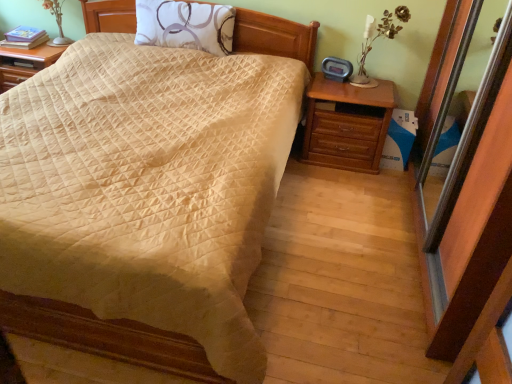
What do you see at coordinates (57, 22) in the screenshot?
I see `matte silver table lamp at upper left, which appears as the first table lamp when viewed from the left` at bounding box center [57, 22].

Where is `beige quilted bed at center`? The height and width of the screenshot is (384, 512). beige quilted bed at center is located at coordinates (105, 337).

Where is `white fabric pillow at upper center`? The height and width of the screenshot is (384, 512). white fabric pillow at upper center is located at coordinates (185, 25).

Measure the distance between point (364,33) and camera.

They are 2.77 meters apart.

Image resolution: width=512 pixels, height=384 pixels. I want to click on matte silver table lamp at upper left, which appears as the second table lamp when viewed from the right, so click(57, 22).

In the image, there is a matte silver table lamp at upper left, the first table lamp positioned from the top. Where is `pillow below it (from the image's perspective)`? Image resolution: width=512 pixels, height=384 pixels. pillow below it (from the image's perspective) is located at coordinates (185, 25).

Based on the photo, from the image's perspective, is matte silver table lamp at upper left, the first table lamp positioned from the top, beneath white fabric pillow at upper center?

No, from the image's perspective, matte silver table lamp at upper left, the first table lamp positioned from the top, is not below white fabric pillow at upper center.

From a real-world perspective, which is physically below, matte silver table lamp at upper left, which appears as the first table lamp when viewed from the left, or white fabric pillow at upper center?

In real-world perspective, matte silver table lamp at upper left, which appears as the first table lamp when viewed from the left, is lower.

Is point (66, 340) positioned before point (62, 33)?

Yes, point (66, 340) is closer to viewer.

Is beige quilted bed at center thinner than matte silver table lamp at upper left, which appears as the second table lamp when viewed from the right?

Incorrect, the width of beige quilted bed at center is not less than that of matte silver table lamp at upper left, which appears as the second table lamp when viewed from the right.

From the image's perspective, which is above, beige quilted bed at center or matte silver table lamp at upper left, the first table lamp in the back-to-front sequence?

matte silver table lamp at upper left, the first table lamp in the back-to-front sequence, appears higher in the image.

Is beige quilted bed at center taller or shorter than matte silver table lamp at upper left, which is the 2th table lamp in front-to-back order?

Considering their sizes, beige quilted bed at center has more height than matte silver table lamp at upper left, which is the 2th table lamp in front-to-back order.

Where is `table lamp that is below the matte silver table lamp at upper left, arranged as the second table lamp when ordered from the bottom (from the image's perspective)`? This screenshot has height=384, width=512. table lamp that is below the matte silver table lamp at upper left, arranged as the second table lamp when ordered from the bottom (from the image's perspective) is located at coordinates (375, 39).

Consider the image. From a real-world perspective, between white ceramic table lamp at upper right, placed as the second table lamp when sorted from back to front, and matte silver table lamp at upper left, the first table lamp in the back-to-front sequence, who is vertically lower?

From a 3D spatial view, matte silver table lamp at upper left, the first table lamp in the back-to-front sequence, is below.

Is white ceramic table lamp at upper right, the second table lamp from the top, aimed at matte silver table lamp at upper left, which appears as the first table lamp when viewed from the left?

No, white ceramic table lamp at upper right, the second table lamp from the top, is not aimed at matte silver table lamp at upper left, which appears as the first table lamp when viewed from the left.

From the image's perspective, which is below, white ceramic table lamp at upper right, the second table lamp from the top, or white fabric pillow at upper center?

From the image's view, white ceramic table lamp at upper right, the second table lamp from the top, is below.

Considering the relative sizes of white ceramic table lamp at upper right, the second table lamp from the top, and white fabric pillow at upper center in the image provided, is white ceramic table lamp at upper right, the second table lamp from the top, taller than white fabric pillow at upper center?

Yes.

Does point (371, 36) come behind point (200, 38)?

No, (371, 36) is closer to viewer.

Considering the positions of objects white ceramic table lamp at upper right, which is counted as the second table lamp, starting from the left, and beige quilted bed at center in the image provided, who is behind, white ceramic table lamp at upper right, which is counted as the second table lamp, starting from the left, or beige quilted bed at center?

white ceramic table lamp at upper right, which is counted as the second table lamp, starting from the left, is more distant.

How many degrees apart are the facing directions of white ceramic table lamp at upper right, the 1th table lamp in the front-to-back sequence, and beige quilted bed at center?

They differ by 0.0431 degrees in their facing directions.

From a real-world perspective, is white ceramic table lamp at upper right, which ranks as the 1th table lamp in bottom-to-top order, positioned under beige quilted bed at center based on gravity?

Incorrect, from a real-world perspective, white ceramic table lamp at upper right, which ranks as the 1th table lamp in bottom-to-top order, is higher than beige quilted bed at center.

Which is in front, point (388, 26) or point (266, 46)?

The point (388, 26) is closer.

Is point (308, 26) positioned in front of point (161, 41)?

That is False.

Considering the sizes of objects beige quilted bed at center and white fabric pillow at upper center in the image provided, who is smaller, beige quilted bed at center or white fabric pillow at upper center?

white fabric pillow at upper center.

Is beige quilted bed at center facing away from white fabric pillow at upper center?

Yes, beige quilted bed at center is positioned with its back facing white fabric pillow at upper center.

Based on the photo, from the image's perspective, between beige quilted bed at center and white fabric pillow at upper center, who is located below?

beige quilted bed at center.

Does white fabric pillow at upper center have a larger size compared to white ceramic table lamp at upper right, the 1th table lamp in the front-to-back sequence?

Yes.

From the image's perspective, which one is positioned lower, white fabric pillow at upper center or white ceramic table lamp at upper right, placed as the second table lamp when sorted from back to front?

From the image's view, white ceramic table lamp at upper right, placed as the second table lamp when sorted from back to front, is below.

Which object is closer to the camera taking this photo, white fabric pillow at upper center or white ceramic table lamp at upper right, which ranks as the 1th table lamp in bottom-to-top order?

white ceramic table lamp at upper right, which ranks as the 1th table lamp in bottom-to-top order, is more forward.

Locate an element on the screen. pillow located above the matte silver table lamp at upper left, the first table lamp positioned from the top (from a real-world perspective) is located at coordinates [x=185, y=25].

From the beige quilted bed at center, count 2nd table lamps backward and point to it. Please provide its 2D coordinates.

[(57, 22)]

Considering their positions, is matte silver table lamp at upper left, which appears as the second table lamp when viewed from the right, positioned further to white fabric pillow at upper center than beige quilted bed at center?

Based on the image, beige quilted bed at center appears to be further to white fabric pillow at upper center.

From the image, which object appears to be nearer to white ceramic table lamp at upper right, placed as the second table lamp when sorted from back to front, matte silver table lamp at upper left, which appears as the first table lamp when viewed from the left, or white fabric pillow at upper center?

white fabric pillow at upper center is closer to white ceramic table lamp at upper right, placed as the second table lamp when sorted from back to front.

When comparing their distances from white ceramic table lamp at upper right, the second table lamp from the top, does white fabric pillow at upper center or beige quilted bed at center seem closer?

white fabric pillow at upper center.

In the scene shown: From the image, which object appears to be nearer to matte silver table lamp at upper left, the first table lamp positioned from the top, white fabric pillow at upper center or white ceramic table lamp at upper right, placed as the second table lamp when sorted from back to front?

white fabric pillow at upper center is closer to matte silver table lamp at upper left, the first table lamp positioned from the top.

Considering their positions, is white ceramic table lamp at upper right, which ranks as the 1th table lamp in bottom-to-top order, positioned further to white fabric pillow at upper center than matte silver table lamp at upper left, which is the 2th table lamp in front-to-back order?

white ceramic table lamp at upper right, which ranks as the 1th table lamp in bottom-to-top order.

Considering their positions, is matte silver table lamp at upper left, which is the 2th table lamp in front-to-back order, positioned further to white fabric pillow at upper center than white ceramic table lamp at upper right, the second table lamp from the top?

white ceramic table lamp at upper right, the second table lamp from the top.

Looking at the image, which one is located closer to white fabric pillow at upper center, beige quilted bed at center or matte silver table lamp at upper left, arranged as the second table lamp when ordered from the bottom?

matte silver table lamp at upper left, arranged as the second table lamp when ordered from the bottom, lies closer to white fabric pillow at upper center than the other object.

Considering their positions, is matte silver table lamp at upper left, arranged as the second table lamp when ordered from the bottom, positioned closer to beige quilted bed at center than white ceramic table lamp at upper right, which is counted as the second table lamp, starting from the left?

white ceramic table lamp at upper right, which is counted as the second table lamp, starting from the left, is positioned closer to the anchor beige quilted bed at center.

The height and width of the screenshot is (384, 512). Identify the location of table lamp between beige quilted bed at center and white fabric pillow at upper center in the front-back direction. (375, 39).

Where is `pillow located between matte silver table lamp at upper left, which is the 2th table lamp in front-to-back order, and white ceramic table lamp at upper right, placed as the second table lamp when sorted from back to front, in the left-right direction`? The image size is (512, 384). pillow located between matte silver table lamp at upper left, which is the 2th table lamp in front-to-back order, and white ceramic table lamp at upper right, placed as the second table lamp when sorted from back to front, in the left-right direction is located at coordinates (185, 25).

You are a GUI agent. You are given a task and a screenshot of the screen. Output one action in this format:
    pyautogui.click(x=<x>, y=<y>)
    Task: Click on the bed located between matte silver table lamp at upper left, arranged as the second table lamp when ordered from the bottom, and white ceramic table lamp at upper right, marked as the 1th table lamp in a right-to-left arrangement, in the left-right direction
    
    Given the screenshot: What is the action you would take?
    pyautogui.click(x=105, y=337)

Where is `pillow between beige quilted bed at center and matte silver table lamp at upper left, arranged as the second table lamp when ordered from the bottom, along the z-axis`? The width and height of the screenshot is (512, 384). pillow between beige quilted bed at center and matte silver table lamp at upper left, arranged as the second table lamp when ordered from the bottom, along the z-axis is located at coordinates (185, 25).